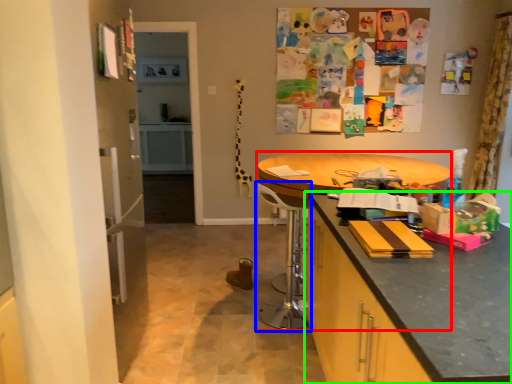
Question: Based on their relative distances, which object is farther from round table (highlighted by a red box)? Choose from swivel chair (highlighted by a blue box) and cabinetry (highlighted by a green box).

Choices:
 (A) swivel chair
 (B) cabinetry

Answer: (B)